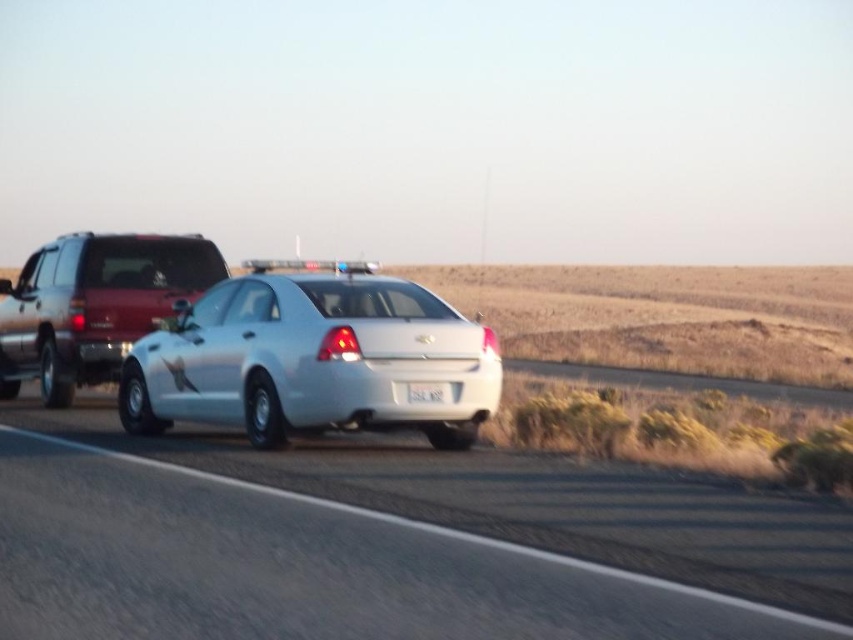
Question: Which of the following is the farthest from the observer?

Choices:
 (A) (349, 545)
 (B) (418, 392)

Answer: (B)

Question: Can you confirm if white glossy car at center is positioned above white plastic license plate at center?

Choices:
 (A) no
 (B) yes

Answer: (A)

Question: Which of the following is the farthest from the observer?

Choices:
 (A) (291, 340)
 (B) (155, 611)

Answer: (A)

Question: Which object appears closest to the camera in this image?

Choices:
 (A) white glossy sedan at center
 (B) white plastic license plate at center

Answer: (A)

Question: Can you confirm if white glossy car at center is wider than white plastic license plate at center?

Choices:
 (A) yes
 (B) no

Answer: (A)

Question: Where is white glossy car at center located in relation to white plastic license plate at center in the image?

Choices:
 (A) right
 (B) left

Answer: (B)